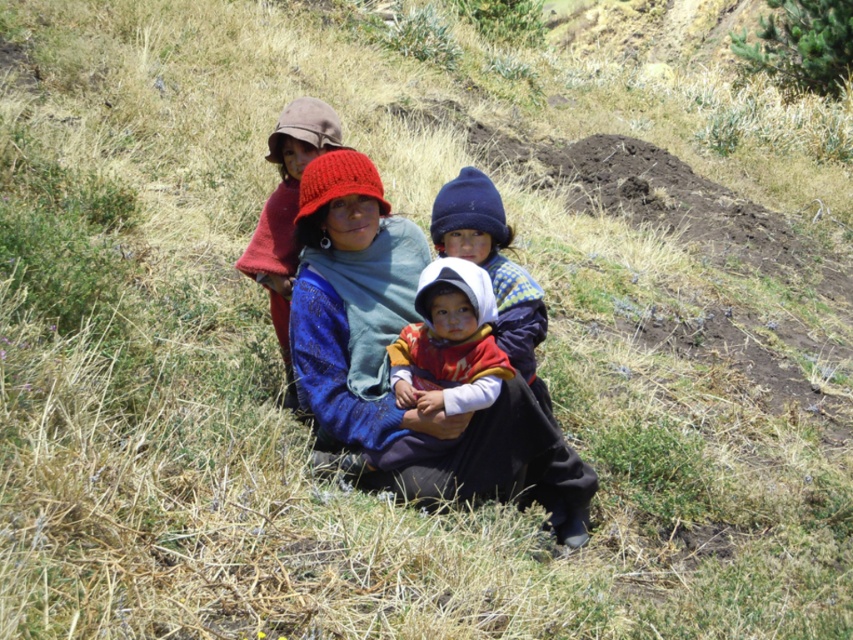
Between point (450, 268) and point (279, 346), which one is positioned in front?

Point (450, 268)

Between multicolored woven cloth at center and knitted wool hat at center, which one is positioned higher?

knitted wool hat at center is above.

Is point (433, 336) more distant than point (267, 257)?

No, it is in front of (267, 257).

This screenshot has height=640, width=853. Find the location of `multicolored woven cloth at center`. multicolored woven cloth at center is located at coordinates (450, 342).